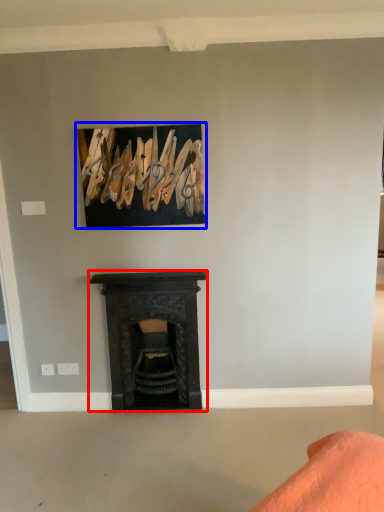
Question: Which point is further to the camera, fireplace (highlighted by a red box) or picture frame (highlighted by a blue box)?

Choices:
 (A) fireplace
 (B) picture frame

Answer: (A)